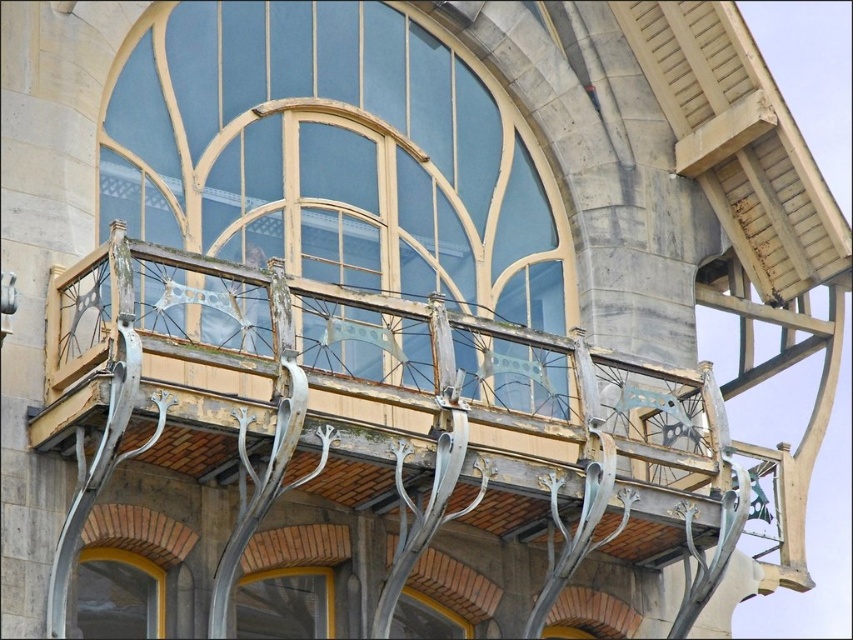
You are standing in front of the building and notice a point marked at coordinates (373, 449). Based on the scene description, which object from the list contains this point?

The point at coordinates (373, 449) is located on the metallic silver balcony at center.

You are an architect designing a new building and want to ensure proper structural support for the balcony. Given the placement of the matte glass window at center and the matte glass window at lower left, which window is located above the other?

The matte glass window at center is positioned over the matte glass window at lower left, so the center window is above the lower left one.